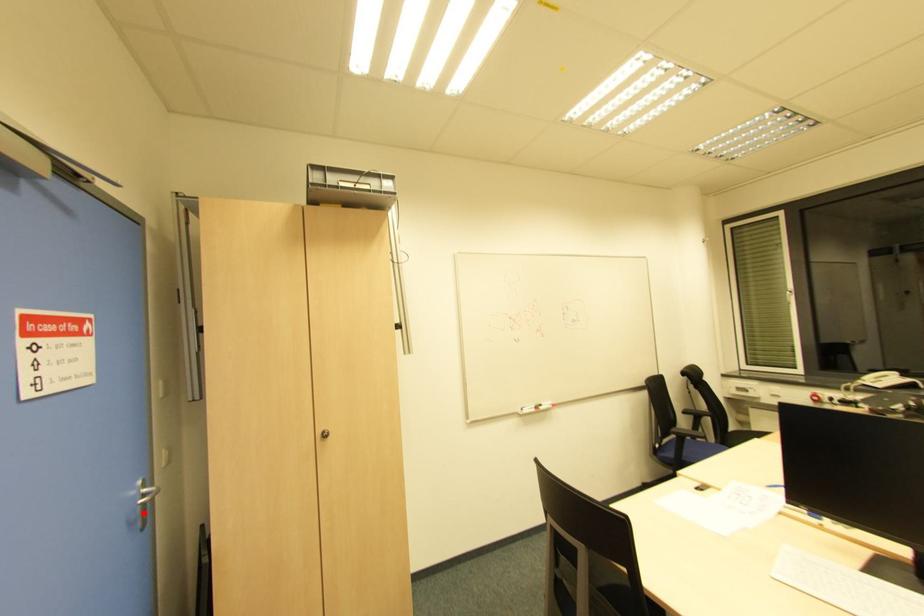
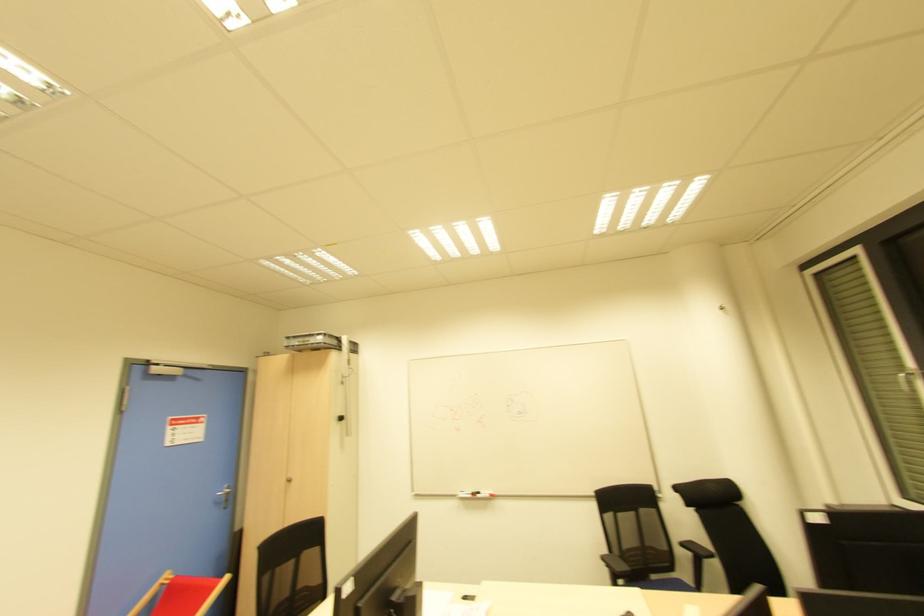
The point at the highlighted location is marked in the first image. Where is the corresponding point in the second image?

(225, 501)